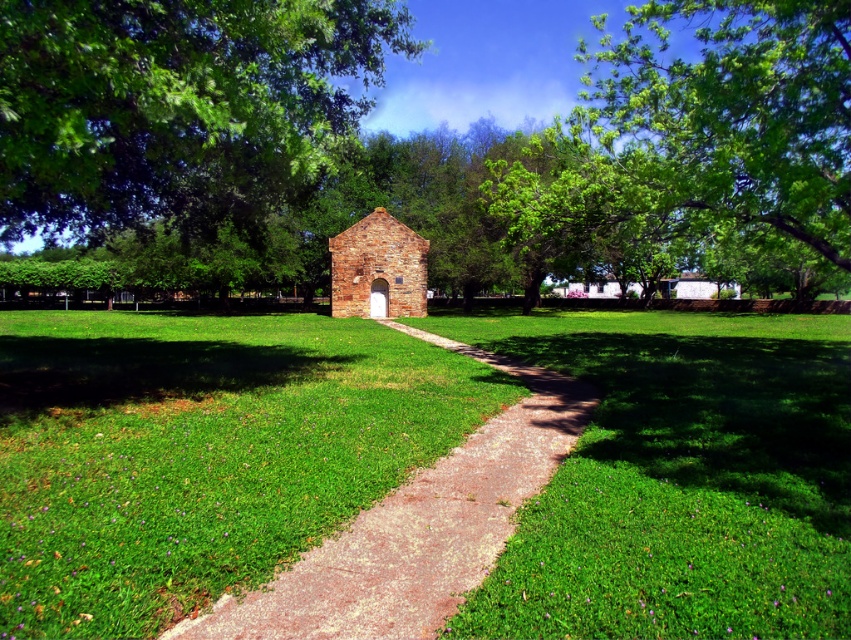
Question: Considering the relative positions of green leafy tree at upper right and paved stone path at center in the image provided, where is green leafy tree at upper right located with respect to paved stone path at center?

Choices:
 (A) above
 (B) below

Answer: (A)

Question: Which point is farther from the camera taking this photo?

Choices:
 (A) (304, 138)
 (B) (423, 272)

Answer: (B)

Question: Is green leafy tree at upper center further to camera compared to green leafy tree at upper right?

Choices:
 (A) yes
 (B) no

Answer: (B)

Question: Among these objects, which one is nearest to the camera?

Choices:
 (A) paved stone path at center
 (B) green leafy tree at upper right

Answer: (A)

Question: Which point is farther to the camera?

Choices:
 (A) (523, 474)
 (B) (634, 19)
 (C) (243, 161)

Answer: (B)

Question: Does green leafy tree at upper center have a larger size compared to paved stone path at center?

Choices:
 (A) yes
 (B) no

Answer: (A)